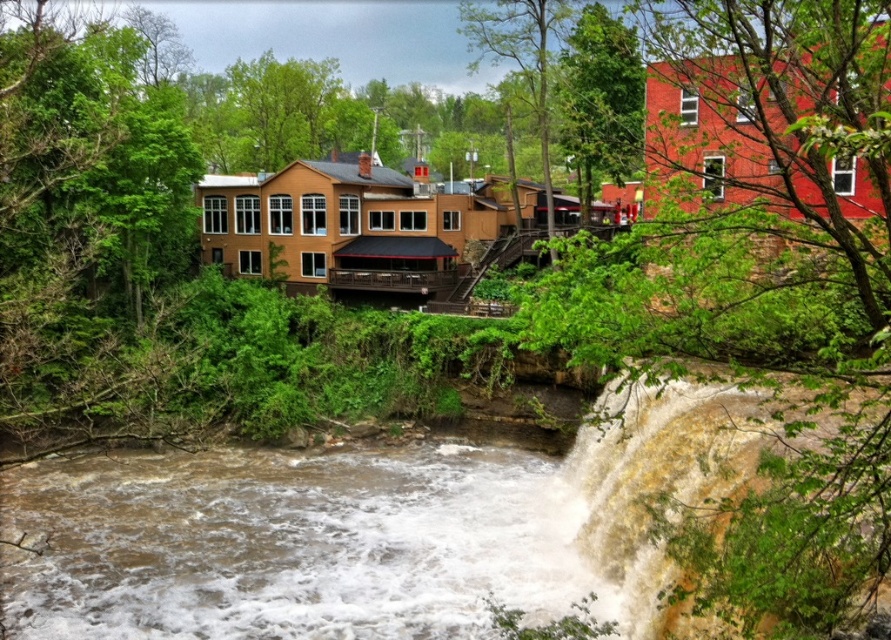
You are a hiker who wants to cross the river using a fallen log bridge. You see the green leafy tree at upper right and the brown muddy water at lower center. Which object would you need to avoid stepping into to stay safe?

You should avoid stepping into the brown muddy water at lower center because it is the water body, while the green leafy tree at upper right is a solid structure. The brown muddy water at lower center is smaller in size than the green leafy tree at upper right, but safety is the priority here.

You are a hiker who wants to cross the brown muddy water at lower center. There is a green leafy tree at upper right nearby. Can you use the tree to help you cross the water safely?

The green leafy tree at upper right is above the brown muddy water at lower center, so you can use its branches to steady yourself while crossing the water safely.

You are standing at the center of the image and want to locate the green leafy tree at upper right. According to the coordinates provided, in which direction should you look to find it?

The green leafy tree at upper right is located at point 0.472 on the x axis and 0.850 on the y axis. Since the coordinates are relative to the image, the tree is positioned towards the upper right direction from the center, so you should look towards the upper right to find it.